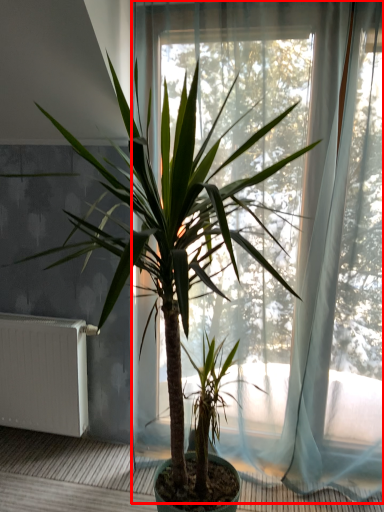
Question: From the image, what is the correct spatial relationship of window (annotated by the red box) in relation to radiator?

Choices:
 (A) left
 (B) right

Answer: (B)